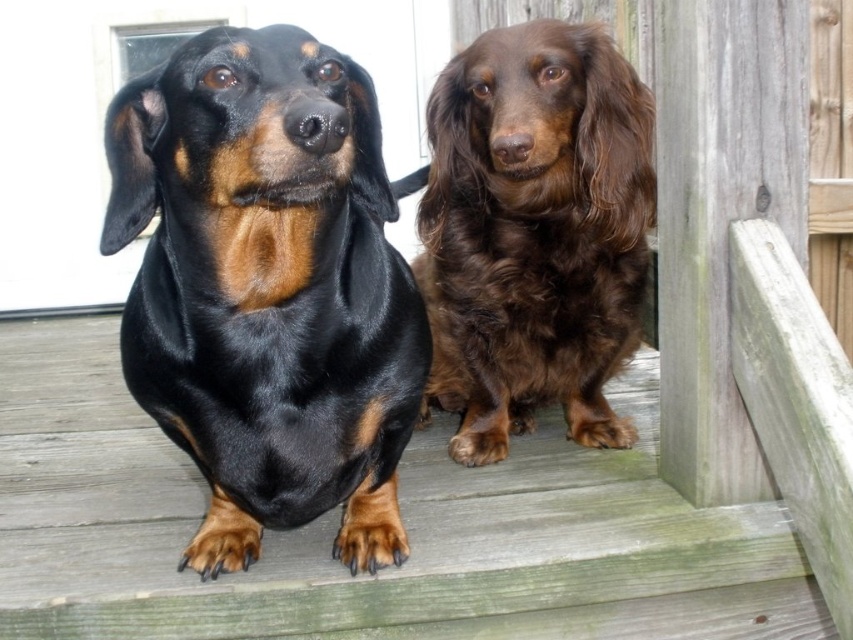
You are a dog trainer assessing the space needed for two dogs. Given that the black shiny fur dog at center and the brown shaggy dog at center are sitting side by side on the deck, which dog requires more space due to its size?

The brown shaggy dog at center requires more space because its width is greater than the black shiny fur dog at center.

You are a photographer aiming to capture both dogs in a single shot. Since the black shiny fur dog at center and the brown shaggy dog at center are sitting on a wooden deck, which dog should you focus on first to ensure both are in frame?

The black shiny fur dog at center is positioned under the brown shaggy dog at center, so you should focus on the brown shaggy dog at center first to ensure both are in frame.